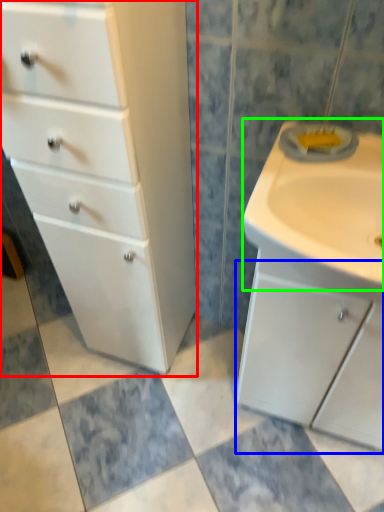
Question: Based on their relative distances, which object is nearer to chest of drawers (highlighted by a red box)? Choose from cabinetry (highlighted by a blue box) and sink (highlighted by a green box).

Choices:
 (A) cabinetry
 (B) sink

Answer: (B)